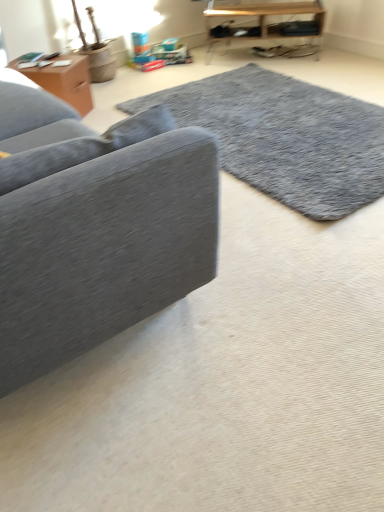
The image size is (384, 512). What do you see at coordinates (66, 83) in the screenshot? I see `matte brown wooden table at upper left, which is the 2th table from back to front` at bounding box center [66, 83].

Identify the location of wooden shelf at upper right, placed as the 2th table when sorted from front to back. The image size is (384, 512). (269, 28).

Is gray shaggy rug at center facing away from wooden shelf at upper right, acting as the 1th table starting from the top?

gray shaggy rug at center does not have its back to wooden shelf at upper right, acting as the 1th table starting from the top.

Who is shorter, gray shaggy rug at center or wooden shelf at upper right, acting as the 1th table starting from the top?

gray shaggy rug at center is shorter.

At what (x,y) coordinates should I click in order to perform the action: click on the 2nd table behind when counting from the gray shaggy rug at center. Please return your answer as a coordinate pair (x, y). The height and width of the screenshot is (512, 384). Looking at the image, I should click on (269, 28).

Between point (363, 117) and point (308, 49), which one is positioned behind?

The point (308, 49) is behind.

Is velvet gray couch at left smaller than gray shaggy rug at center?

No, velvet gray couch at left is not smaller than gray shaggy rug at center.

Between velvet gray couch at left and gray shaggy rug at center, which one has less height?

gray shaggy rug at center is shorter.

In the image, is velvet gray couch at left positioned in front of or behind gray shaggy rug at center?

Clearly, velvet gray couch at left is in front of gray shaggy rug at center.

How many degrees apart are the facing directions of velvet gray couch at left and gray shaggy rug at center?

The angular difference between velvet gray couch at left and gray shaggy rug at center is 179 degrees.

Is velvet gray couch at left bigger than wooden shelf at upper right, acting as the 1th table starting from the top?

Correct, velvet gray couch at left is larger in size than wooden shelf at upper right, acting as the 1th table starting from the top.

Is velvet gray couch at left spatially inside wooden shelf at upper right, the 1th table in the right-to-left sequence, or outside of it?

velvet gray couch at left is outside wooden shelf at upper right, the 1th table in the right-to-left sequence.

Can you confirm if velvet gray couch at left is shorter than wooden shelf at upper right, positioned as the first table in back-to-front order?

In fact, velvet gray couch at left may be taller than wooden shelf at upper right, positioned as the first table in back-to-front order.

In the scene shown: From the image's perspective, which one is positioned lower, velvet gray couch at left or wooden shelf at upper right, placed as the 2th table when sorted from front to back?

velvet gray couch at left.

Is point (81, 99) closer or farther from the camera than point (381, 179)?

Point (81, 99) appears to be farther away from the viewer than point (381, 179).

Which is more to the right, matte brown wooden table at upper left, the 1th table positioned from the left, or gray shaggy rug at center?

Positioned to the right is gray shaggy rug at center.

Where is `mat in front of the matte brown wooden table at upper left, which ranks as the first table in front-to-back order`? The image size is (384, 512). mat in front of the matte brown wooden table at upper left, which ranks as the first table in front-to-back order is located at coordinates (286, 137).

Considering the sizes of objects matte brown wooden table at upper left, which ranks as the first table in front-to-back order, and velvet gray couch at left in the image provided, who is smaller, matte brown wooden table at upper left, which ranks as the first table in front-to-back order, or velvet gray couch at left?

matte brown wooden table at upper left, which ranks as the first table in front-to-back order.

Is point (81, 72) positioned before point (172, 242)?

No, it is not.

Based on their positions, is matte brown wooden table at upper left, which is the first table in bottom-to-top order, located to the left or right of velvet gray couch at left?

matte brown wooden table at upper left, which is the first table in bottom-to-top order, is to the left of velvet gray couch at left.

Would you say matte brown wooden table at upper left, the 1th table positioned from the left, is inside or outside velvet gray couch at left?

matte brown wooden table at upper left, the 1th table positioned from the left, is not enclosed by velvet gray couch at left.

From a real-world perspective, is gray shaggy rug at center positioned above or below velvet gray couch at left?

Clearly, from a real-world perspective, gray shaggy rug at center is below velvet gray couch at left.

From the image's perspective, is gray shaggy rug at center located above or below velvet gray couch at left?

Clearly, from the image's perspective, gray shaggy rug at center is above velvet gray couch at left.

Is gray shaggy rug at center located outside velvet gray couch at left?

Yes.

Can you see matte brown wooden table at upper left, the 2th table from the right, touching wooden shelf at upper right, the 1th table in the right-to-left sequence?

No.

Find the location of `table in front of the wooden shelf at upper right, placed as the 2th table when sorted from front to back`. table in front of the wooden shelf at upper right, placed as the 2th table when sorted from front to back is located at coordinates coord(66,83).

From a real-world perspective, is matte brown wooden table at upper left, the 2th table from the right, on wooden shelf at upper right, the 1th table in the right-to-left sequence?

Actually, matte brown wooden table at upper left, the 2th table from the right, is physically below wooden shelf at upper right, the 1th table in the right-to-left sequence, in the real world.

From the image's perspective, starting from the gray shaggy rug at center, which table is the 2nd one above? Please provide its 2D coordinates.

[(269, 28)]

Identify the location of studio couch that is above the gray shaggy rug at center (from a real-world perspective). (95, 233).

Estimate the real-world distances between objects in this image. Which object is further from matte brown wooden table at upper left, the 2th table from the right, wooden shelf at upper right, the 1th table in the right-to-left sequence, or gray shaggy rug at center?

wooden shelf at upper right, the 1th table in the right-to-left sequence.

Considering their positions, is matte brown wooden table at upper left, the 2th table from the right, positioned further to gray shaggy rug at center than wooden shelf at upper right, acting as the 1th table starting from the top?

wooden shelf at upper right, acting as the 1th table starting from the top.

Looking at the image, which one is located closer to velvet gray couch at left, gray shaggy rug at center or wooden shelf at upper right, acting as the 1th table starting from the top?

The object closer to velvet gray couch at left is gray shaggy rug at center.

From the picture: Which object lies further to the anchor point matte brown wooden table at upper left, the 2th table from the right, gray shaggy rug at center or velvet gray couch at left?

velvet gray couch at left.

Which object lies nearer to the anchor point matte brown wooden table at upper left, which is the first table in bottom-to-top order, gray shaggy rug at center or wooden shelf at upper right, acting as the 1th table starting from the top?

Among the two, gray shaggy rug at center is located nearer to matte brown wooden table at upper left, which is the first table in bottom-to-top order.

When comparing their distances from wooden shelf at upper right, positioned as the 2th table in left-to-right order, does matte brown wooden table at upper left, which is the first table in bottom-to-top order, or velvet gray couch at left seem closer?

Among the two, matte brown wooden table at upper left, which is the first table in bottom-to-top order, is located nearer to wooden shelf at upper right, positioned as the 2th table in left-to-right order.

When comparing their distances from velvet gray couch at left, does matte brown wooden table at upper left, which is the 2th table from back to front, or gray shaggy rug at center seem closer?

gray shaggy rug at center is closer to velvet gray couch at left.

Considering their positions, is velvet gray couch at left positioned closer to gray shaggy rug at center than matte brown wooden table at upper left, which ranks as the first table in front-to-back order?

matte brown wooden table at upper left, which ranks as the first table in front-to-back order, is positioned closer to the anchor gray shaggy rug at center.

This screenshot has height=512, width=384. I want to click on mat located between velvet gray couch at left and matte brown wooden table at upper left, which is the first table in bottom-to-top order, in the depth direction, so click(286, 137).

Locate an element on the screen. The width and height of the screenshot is (384, 512). mat between velvet gray couch at left and wooden shelf at upper right, the 1th table in the right-to-left sequence, from front to back is located at coordinates (286, 137).

I want to click on table between velvet gray couch at left and wooden shelf at upper right, positioned as the 2th table in left-to-right order, from front to back, so click(x=66, y=83).

At what (x,y) coordinates should I click in order to perform the action: click on mat situated between matte brown wooden table at upper left, which is the 2th table from back to front, and wooden shelf at upper right, acting as the 1th table starting from the top, from left to right. Please return your answer as a coordinate pair (x, y). The image size is (384, 512). Looking at the image, I should click on (286, 137).